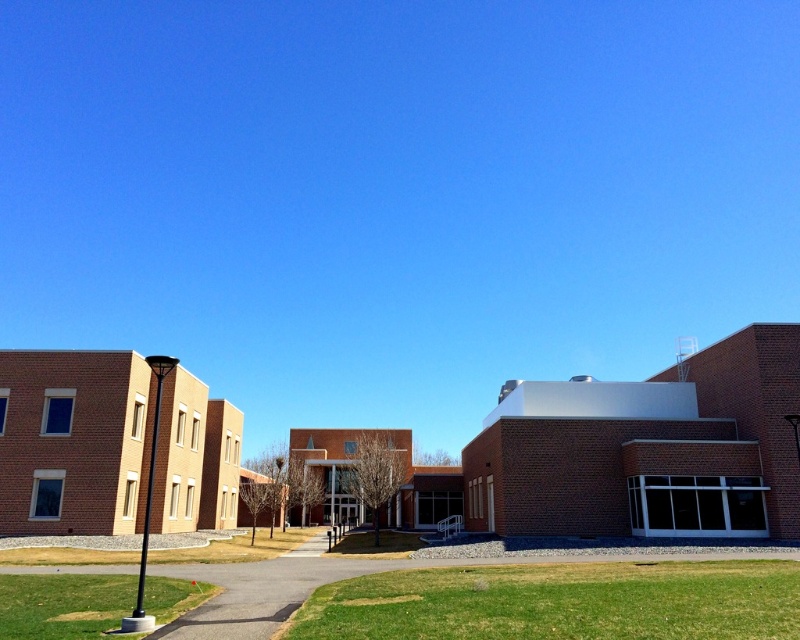
Where is `green grass at lower center`? The image size is (800, 640). green grass at lower center is located at coordinates (560, 602).

Consider the image. Is green grass at lower center below green grass at lower left?

Incorrect, green grass at lower center is not positioned below green grass at lower left.

Is point (596, 572) positioned after point (90, 618)?

Yes.

This screenshot has height=640, width=800. Find the location of `green grass at lower center`. green grass at lower center is located at coordinates pos(560,602).

Who is higher up, gravel paved path at lower center or green grass at lower left?

green grass at lower left is above.

Locate an element on the screen. This screenshot has width=800, height=640. gravel paved path at lower center is located at coordinates (264, 589).

Who is lower down, brick building at center or green grass at lower center?

Positioned lower is brick building at center.

Image resolution: width=800 pixels, height=640 pixels. Find the location of `brick building at center`. brick building at center is located at coordinates (608, 452).